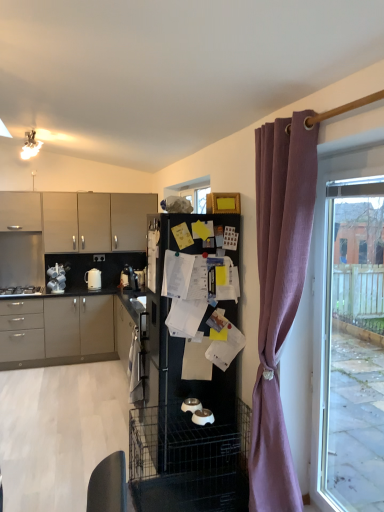
Where is `free space in front of white glossy pet bowls at center, which is the first appliance in front-to-back order`? free space in front of white glossy pet bowls at center, which is the first appliance in front-to-back order is located at coordinates (200, 437).